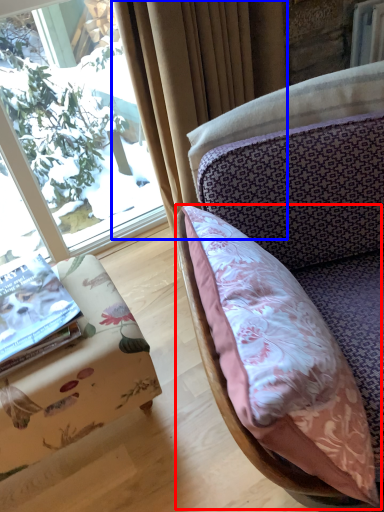
Question: Which of the following is the closest to the observer, pillow (highlighted by a red box) or curtain (highlighted by a blue box)?

Choices:
 (A) pillow
 (B) curtain

Answer: (A)